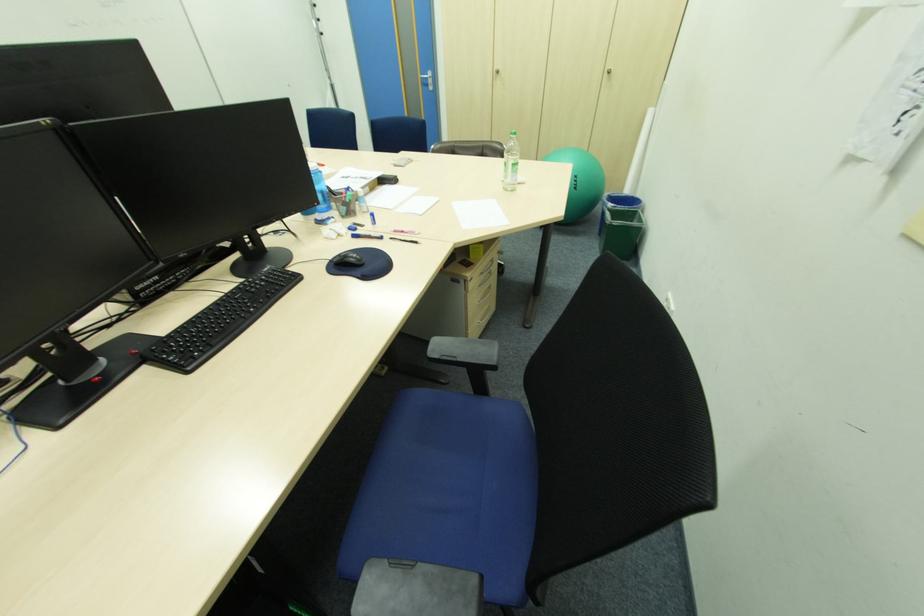
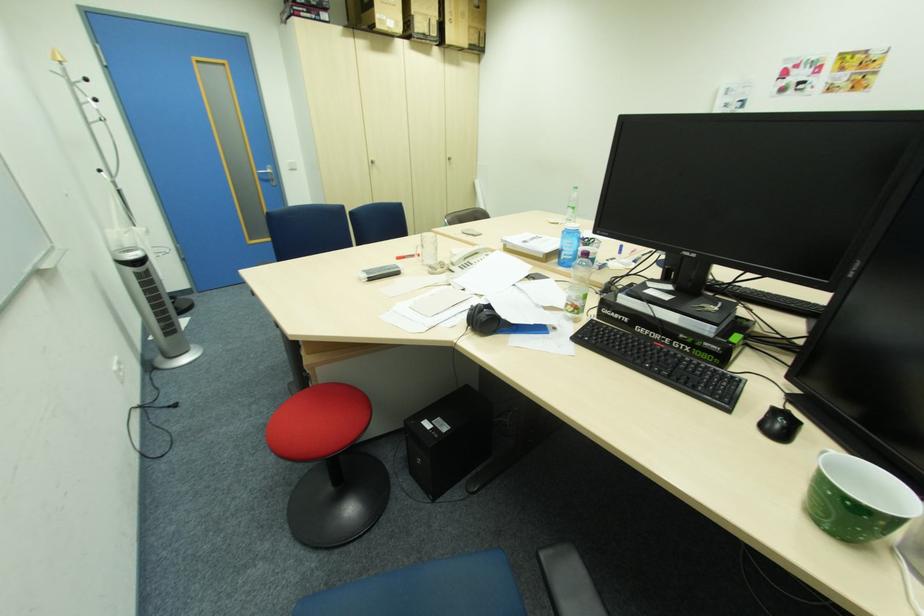
In the second image, find the point that corresponds to point (428, 79) in the first image.

(264, 174)